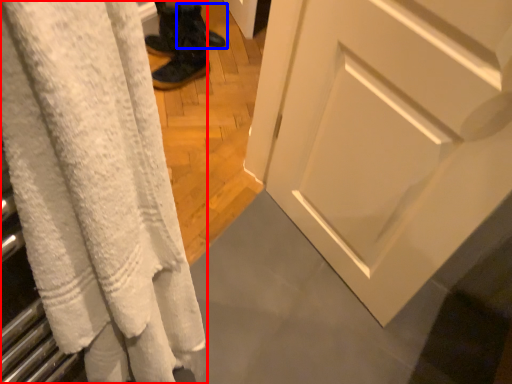
Question: Which object appears farthest to the camera in this image, curtain (highlighted by a red box) or footwear (highlighted by a blue box)?

Choices:
 (A) curtain
 (B) footwear

Answer: (B)